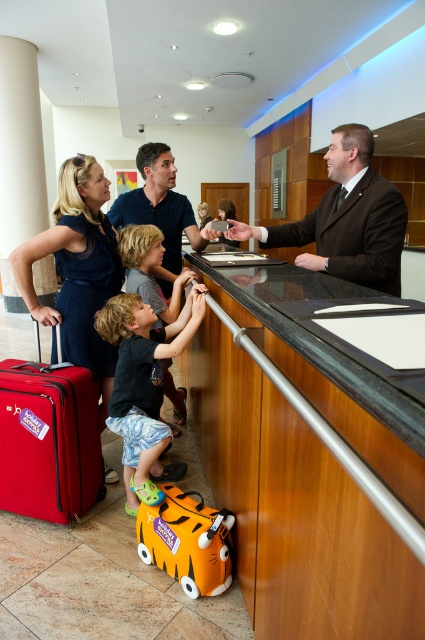
You are a hotel guest approaching the reception desk and see the matte black dress at center and the black matte shirt at center. Which one is closer to you?

The matte black dress at center is closer to you because it is further to the viewer than the black matte shirt at center.